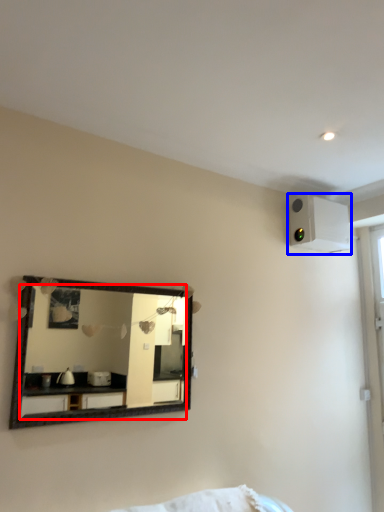
Question: Which of the following is the closest to the observer, mirror (highlighted by a red box) or air conditioning (highlighted by a blue box)?

Choices:
 (A) mirror
 (B) air conditioning

Answer: (A)